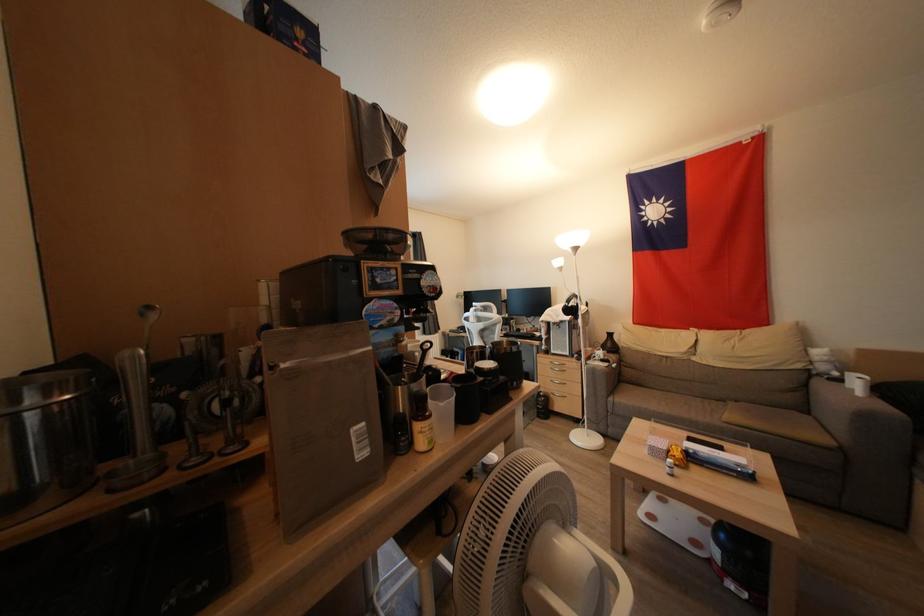
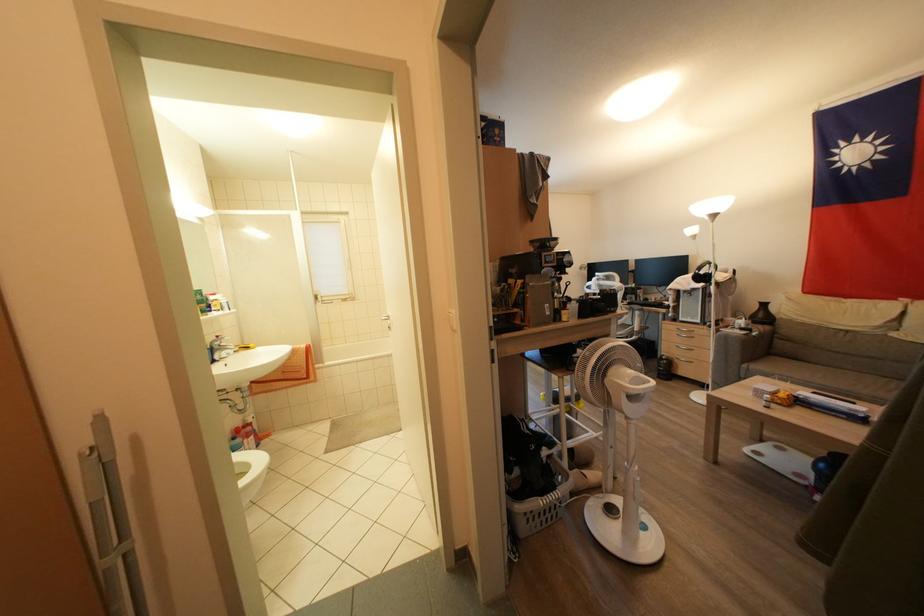
The point at [298,378] is marked in the first image. Where is the corresponding point in the second image?

(537, 291)